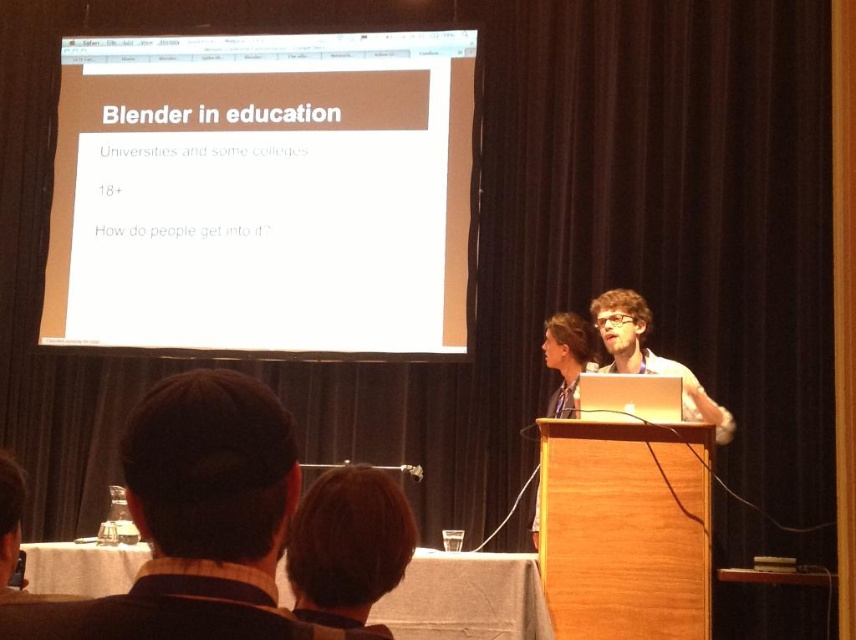
You are an attendee sitting in the front row of the presentation. You notice the white paper at upper center and the matte white laptop at center. Which object is closer to you?

The white paper at upper center is closer to you because it is further to the viewer than the matte white laptop at center, meaning it appears nearer in the visual perspective.

You are an attendee at the presentation and want to see both the dark brown hair at lower center and the matte white laptop at center clearly. Which one is closer to you?

The dark brown hair at lower center is closer to you because it is in front of the matte white laptop at center.